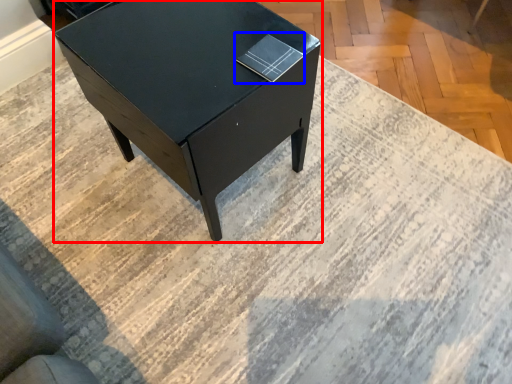
Question: Which of the following is the farthest to the observer, table (highlighted by a red box) or book (highlighted by a blue box)?

Choices:
 (A) table
 (B) book

Answer: (B)